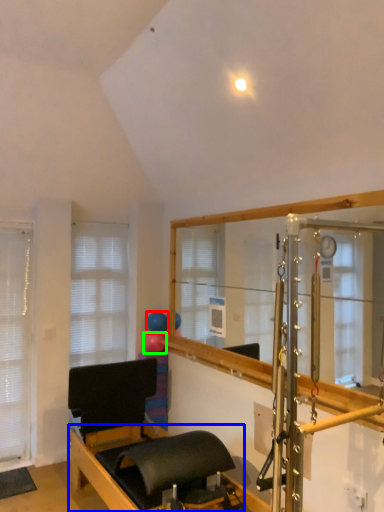
Question: Considering the real-world distances, which object is closest to balloon (highlighted by a red box)? bed frame (highlighted by a blue box) or balloon (highlighted by a green box).

Choices:
 (A) bed frame
 (B) balloon

Answer: (B)